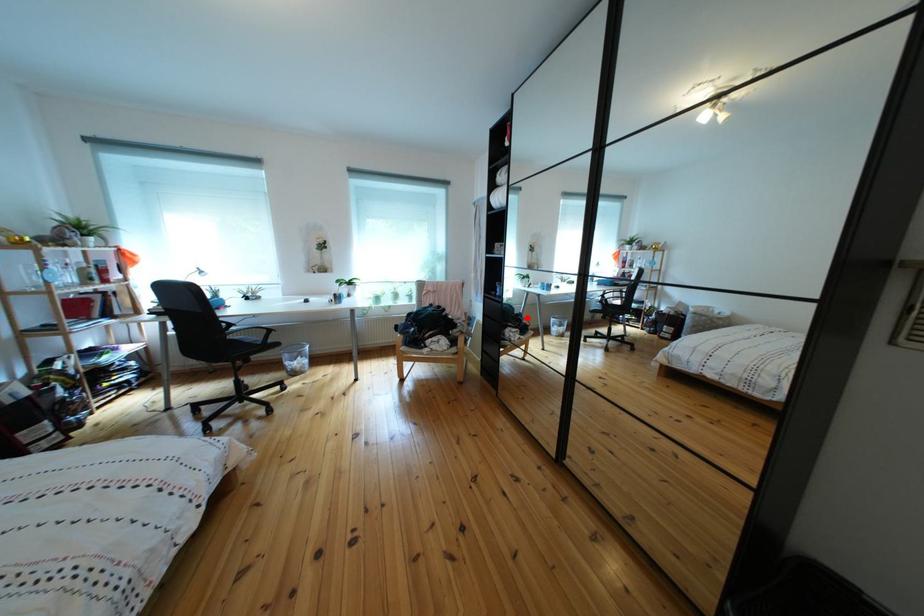
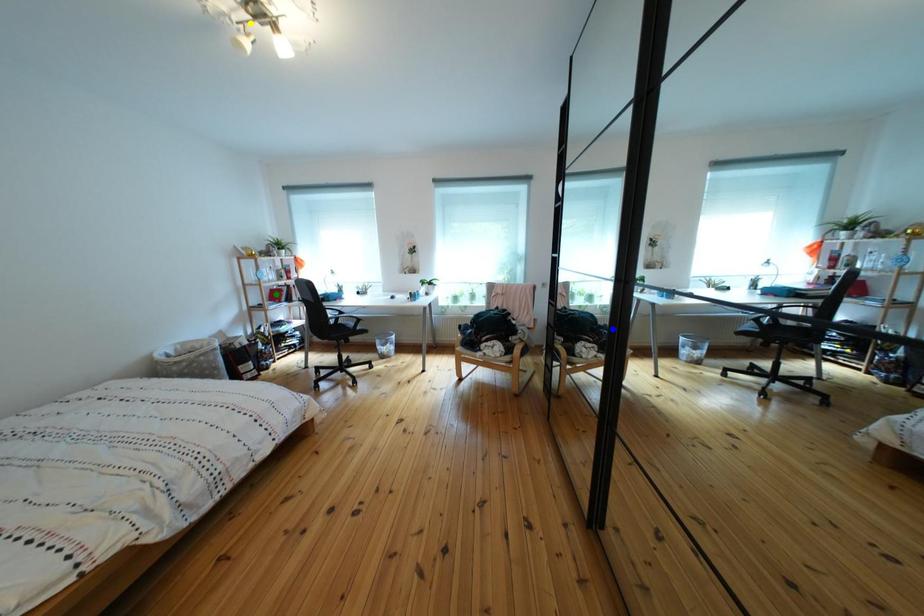
Question: I am providing you with two images of the same scene from different viewpoints. A red point is marked on the first image. You are given multiple points on the second image. Which point in image 2 is actually the same real-world point as the red point in image 1?

Choices:
 (A) blue point
 (B) green point
 (C) yellow point

Answer: (A)